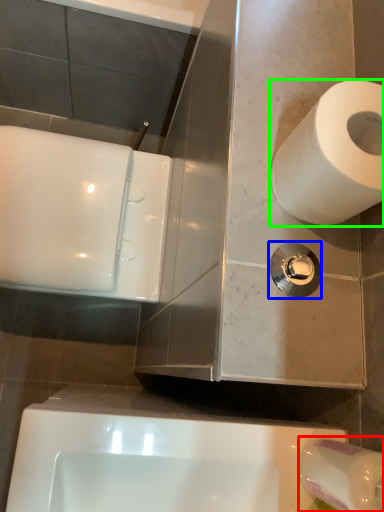
Question: Considering the real-world distances, which object is farthest from toilet paper (highlighted by a red box)? plumbing fixture (highlighted by a blue box) or toilet paper (highlighted by a green box)?

Choices:
 (A) plumbing fixture
 (B) toilet paper

Answer: (B)